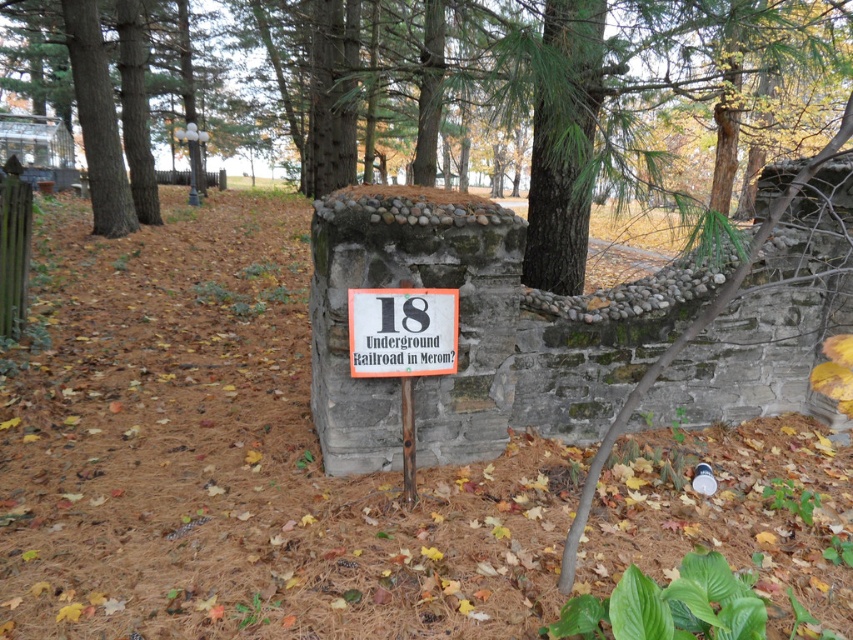
Is green textured stone wall at center thinner than white plastic sign at center?

Incorrect, green textured stone wall at center's width is not less than white plastic sign at center's.

Does green textured stone wall at center appear on the left side of white plastic sign at center?

Correct, you'll find green textured stone wall at center to the left of white plastic sign at center.

What do you see at coordinates (517, 86) in the screenshot?
I see `green textured stone wall at center` at bounding box center [517, 86].

This screenshot has width=853, height=640. I want to click on green textured stone wall at center, so click(517, 86).